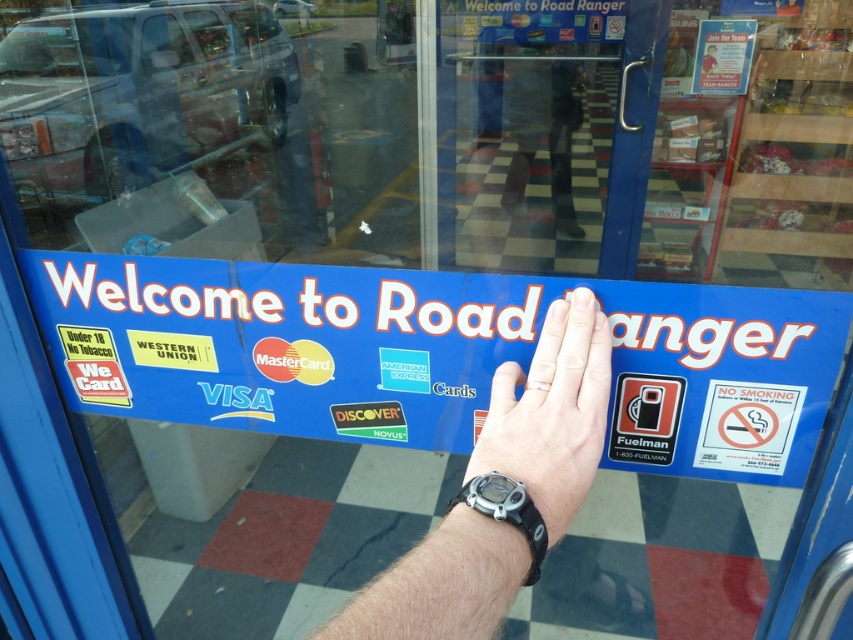
Measure the distance between point (769, 365) and camera.

Point (769, 365) is 28.00 inches from camera.

Is blue plastic sign at center smaller than black rubber watch at center?

Actually, blue plastic sign at center might be larger than black rubber watch at center.

Is point (165, 356) more distant than point (494, 468)?

Yes, point (165, 356) is farther from viewer.

Where is `blue plastic sign at center`? blue plastic sign at center is located at coordinates 438,355.

Is blue plastic sign at center thinner than black rubber watch at lower center?

Incorrect, blue plastic sign at center's width is not less than black rubber watch at lower center's.

Is blue plastic sign at center shorter than black rubber watch at lower center?

No.

Does point (190, 330) come closer to viewer compared to point (486, 515)?

No.

Identify the location of blue plastic sign at center. The image size is (853, 640). (438, 355).

Which is below, black rubber wristband at center or black rubber watch at lower center?

black rubber watch at lower center is lower down.

Between black rubber wristband at center and black rubber watch at lower center, which one has less height?

black rubber watch at lower center

Between point (592, 333) and point (490, 484), which one is positioned behind?

The point (592, 333) is behind.

Find the location of a particular element. black rubber wristband at center is located at coordinates (502, 492).